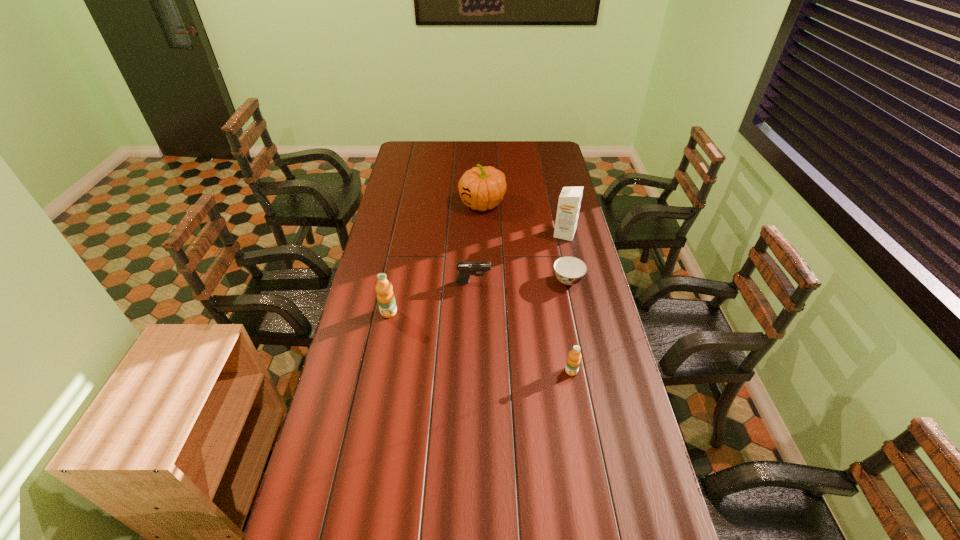
The height and width of the screenshot is (540, 960). Identify the location of free space between the shortest object and the farthest object. (525, 242).

Where is `object that can be found as the second closest to the soup bowl`? object that can be found as the second closest to the soup bowl is located at coordinates (466, 269).

Identify which object is the third nearest to the soup bowl. Please provide its 2D coordinates. Your answer should be formatted as a tuple, i.e. [(x, y)], where the tuple contains the x and y coordinates of a point satisfying the conditions above.

[(573, 361)]

The image size is (960, 540). Identify the location of vacant area that satisfies the following two spatial constraints: 1. on the surface of the pumpkin; 2. on the label of the left orange juice. (483, 312).

Image resolution: width=960 pixels, height=540 pixels. What are the coordinates of `blank space that satisfies the following two spatial constraints: 1. at the barrel of the pistol; 2. on the label of the taller orange juice` in the screenshot? It's located at (472, 312).